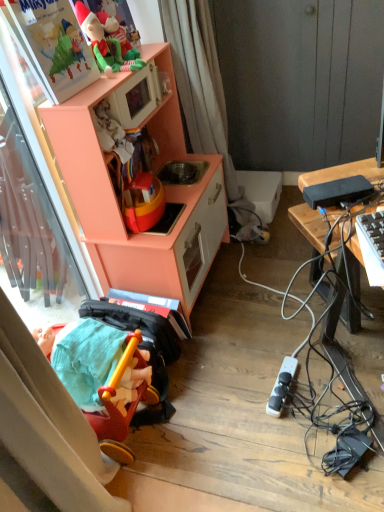
Where is `space that is in front of black plastic desk at right`? The width and height of the screenshot is (384, 512). space that is in front of black plastic desk at right is located at coordinates (341, 364).